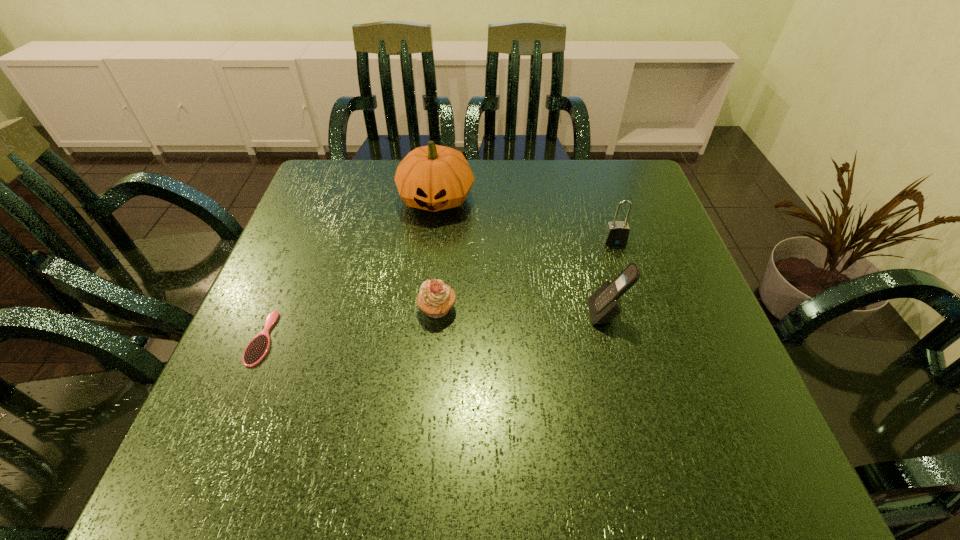
I want to click on free space located on the front-facing side of the fourth object from left to right, so click(439, 314).

Locate an element on the screen. The width and height of the screenshot is (960, 540). vacant space located 0.220m on the front-facing side of the fourth object from left to right is located at coordinates (479, 314).

Where is `blank area located on the shackle of the second farthest object`? The image size is (960, 540). blank area located on the shackle of the second farthest object is located at coordinates (659, 377).

The image size is (960, 540). Identify the location of free point located on the back of the cupcake. (444, 243).

Identify the location of vacant space located 0.260m on the back of the shortest object. The image size is (960, 540). (308, 228).

Locate an element on the screen. The image size is (960, 540). object that is at the far edge is located at coordinates (434, 178).

Locate an element on the screen. Image resolution: width=960 pixels, height=540 pixels. object located at the left edge is located at coordinates (257, 349).

At what (x,y) coordinates should I click in order to perform the action: click on object that is at the right edge. Please return your answer as a coordinate pair (x, y). Looking at the image, I should click on (617, 232).

In the image, there is a desktop. Where is `vacant space at the far edge`? The height and width of the screenshot is (540, 960). vacant space at the far edge is located at coordinates (372, 193).

The width and height of the screenshot is (960, 540). What are the coordinates of `vacant space at the near edge` in the screenshot? It's located at (639, 457).